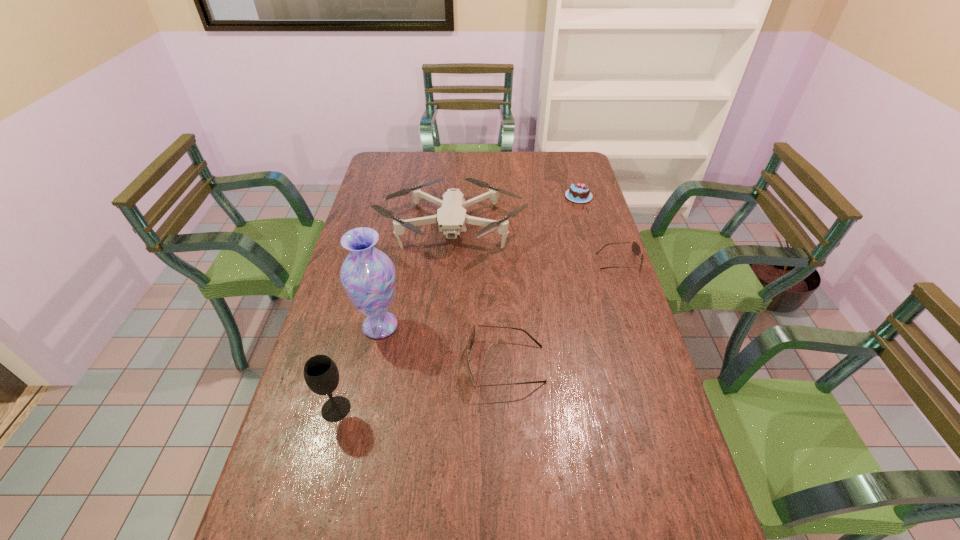
Considering the uniform spacing of sunglassess, where should an additional sunglasses be positioned on the left? Please locate a free spot. Please provide its 2D coordinates. Your answer should be formatted as a tuple, i.e. [(x, y)], where the tuple contains the x and y coordinates of a point satisfying the conditions above.

[(318, 536)]